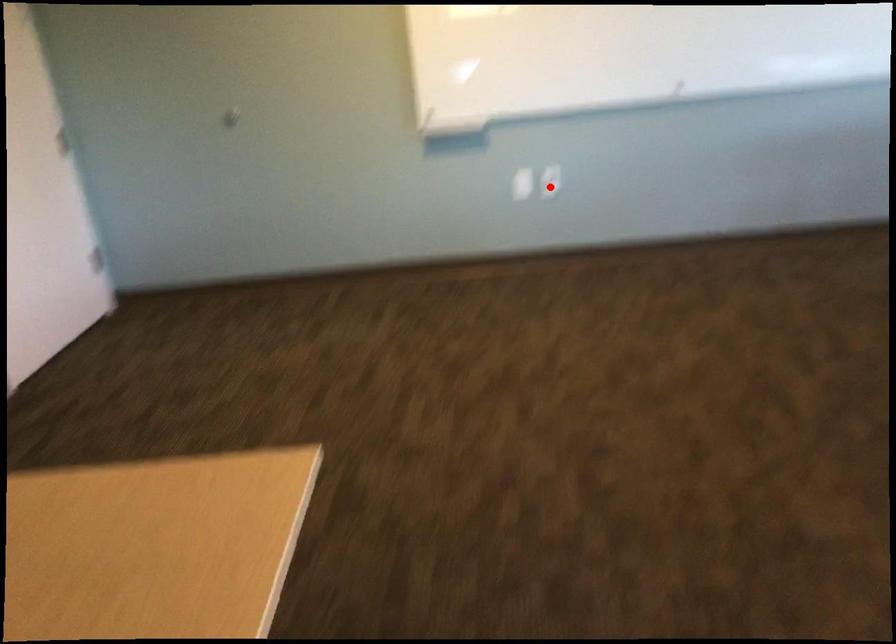
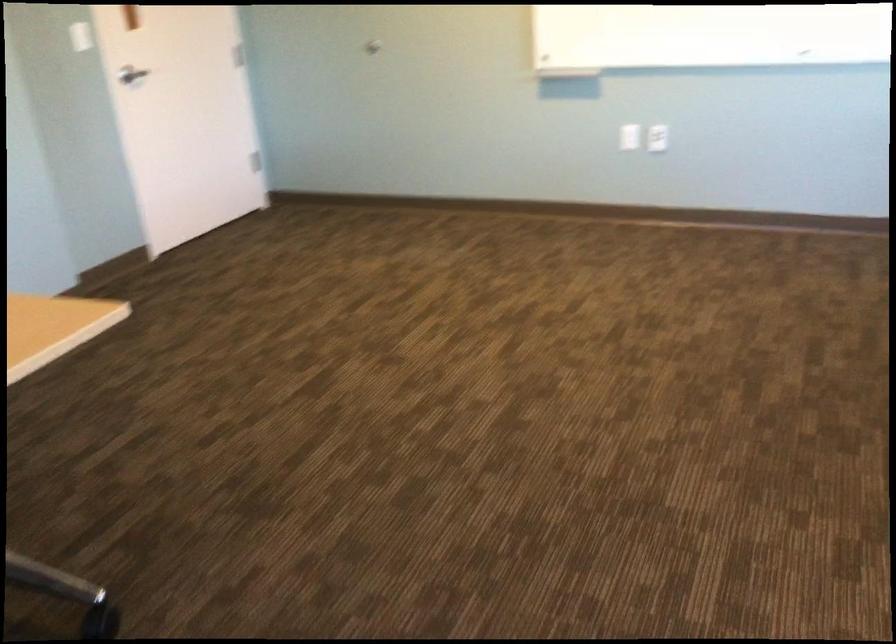
Locate, in the second image, the point that corresponds to the highlighted location in the first image.

(657, 138)